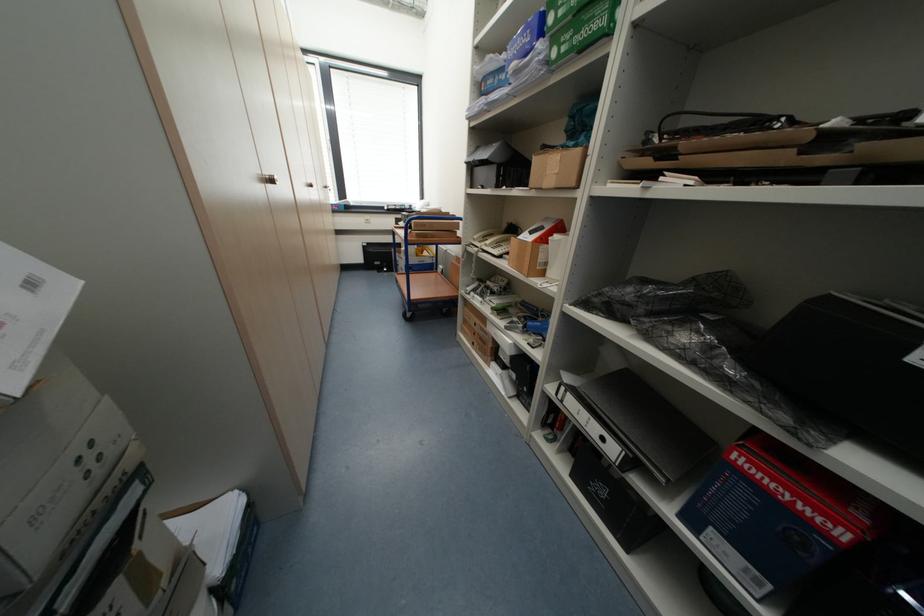
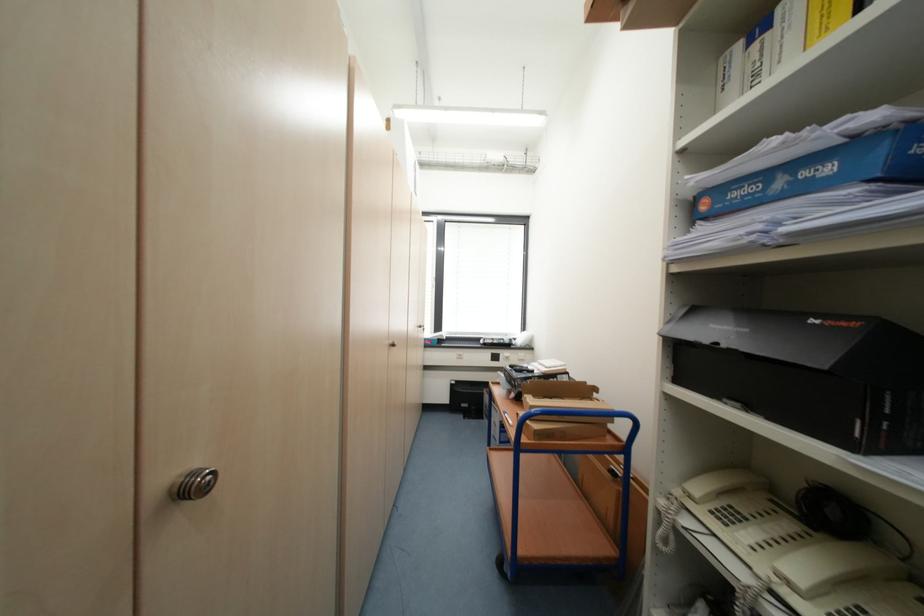
Find the pixel in the second image that matches pixel 480 240 in the first image.

(697, 498)